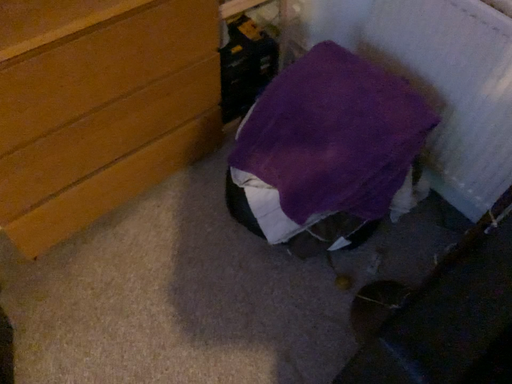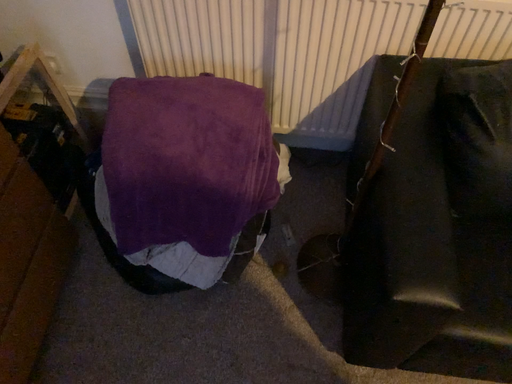
Question: Which way did the camera rotate in the video?

Choices:
 (A) rotated right
 (B) rotated left

Answer: (A)